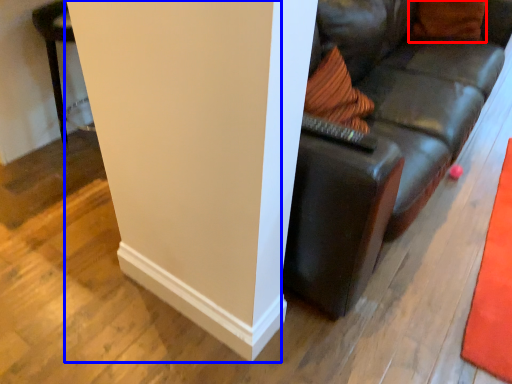
Question: Which object is further to the camera taking this photo, pillow (highlighted by a red box) or pillar (highlighted by a blue box)?

Choices:
 (A) pillow
 (B) pillar

Answer: (A)